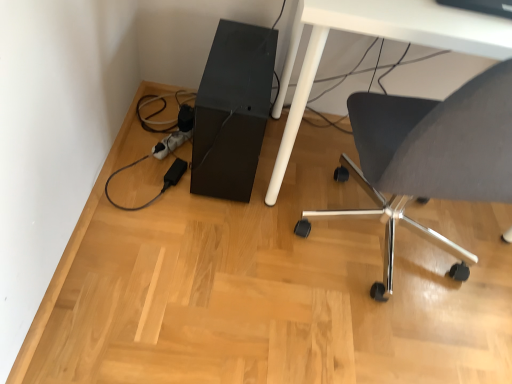
Question: Is white glossy table at lower right to the left of matte gray chair at lower right from the viewer's perspective?

Choices:
 (A) yes
 (B) no

Answer: (B)

Question: Can you confirm if white glossy table at lower right is smaller than matte gray chair at lower right?

Choices:
 (A) no
 (B) yes

Answer: (A)

Question: Is white glossy table at lower right completely or partially outside of matte gray chair at lower right?

Choices:
 (A) no
 (B) yes

Answer: (B)

Question: Can you confirm if white glossy table at lower right is bigger than matte gray chair at lower right?

Choices:
 (A) yes
 (B) no

Answer: (A)

Question: Does white glossy table at lower right have a greater height compared to matte gray chair at lower right?

Choices:
 (A) yes
 (B) no

Answer: (B)

Question: Visually, is black matte computer tower at lower center positioned to the left or to the right of matte gray chair at lower right?

Choices:
 (A) left
 (B) right

Answer: (A)

Question: Considering the positions of black matte computer tower at lower center and matte gray chair at lower right in the image, is black matte computer tower at lower center wider or thinner than matte gray chair at lower right?

Choices:
 (A) wide
 (B) thin

Answer: (B)

Question: Relative to matte gray chair at lower right, is black matte computer tower at lower center in front or behind?

Choices:
 (A) behind
 (B) front

Answer: (A)

Question: From the image's perspective, is black matte computer tower at lower center located above or below matte gray chair at lower right?

Choices:
 (A) below
 (B) above

Answer: (B)

Question: Considering the relative positions of black matte computer tower at lower center and white glossy table at lower right in the image provided, is black matte computer tower at lower center to the left or to the right of white glossy table at lower right?

Choices:
 (A) right
 (B) left

Answer: (B)

Question: Is black matte computer tower at lower center situated inside white glossy table at lower right or outside?

Choices:
 (A) outside
 (B) inside

Answer: (A)

Question: In terms of width, does black matte computer tower at lower center look wider or thinner when compared to white glossy table at lower right?

Choices:
 (A) thin
 (B) wide

Answer: (A)

Question: Relative to white glossy table at lower right, is black matte computer tower at lower center in front or behind?

Choices:
 (A) behind
 (B) front

Answer: (A)

Question: Which is correct: matte gray chair at lower right is inside white glossy table at lower right, or outside of it?

Choices:
 (A) inside
 (B) outside

Answer: (A)

Question: Considering the positions of point (394, 97) and point (353, 18), is point (394, 97) closer or farther from the camera than point (353, 18)?

Choices:
 (A) closer
 (B) farther

Answer: (B)